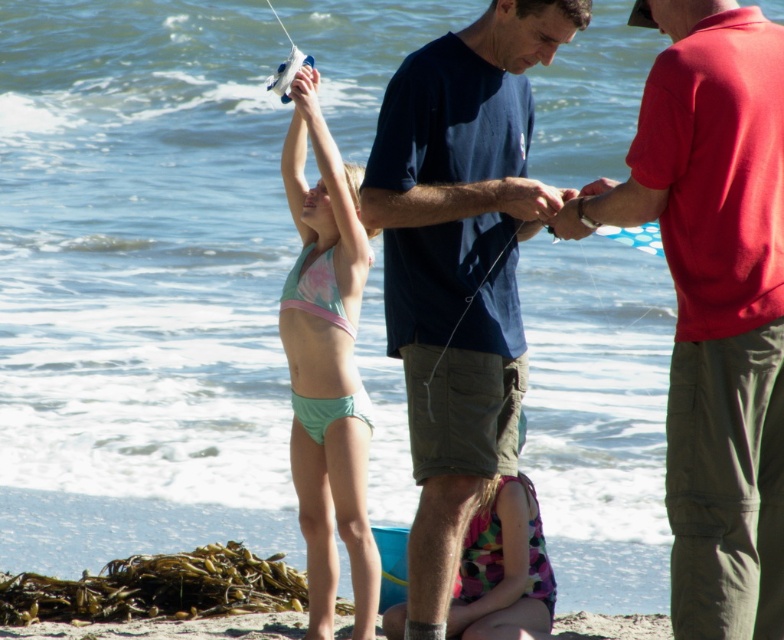
Which is more to the left, red cotton shirt at right or teal fabric bikini at center?

From the viewer's perspective, teal fabric bikini at center appears more on the left side.

Is point (585, 198) in front of point (302, 141)?

That is True.

Who is more forward, [763,461] or [325,582]?

Positioned in front is point [763,461].

Where is `red cotton shirt at right`? red cotton shirt at right is located at coordinates (714, 301).

Who is lower down, teal fabric bikini at center or multicolored polka dot swimsuit at center?

Positioned lower is multicolored polka dot swimsuit at center.

Find the location of a particular element. This screenshot has width=784, height=640. teal fabric bikini at center is located at coordinates (327, 365).

Which is behind, point (322, 595) or point (495, 484)?

Point (322, 595)

Image resolution: width=784 pixels, height=640 pixels. Identify the location of teal fabric bikini at center. (327, 365).

In the scene shown: Does dark blue t-shirt at center appear under multicolored polka dot swimsuit at center?

Actually, dark blue t-shirt at center is above multicolored polka dot swimsuit at center.

Which is above, dark blue t-shirt at center or multicolored polka dot swimsuit at center?

dark blue t-shirt at center is above.

Find the location of a particular element. The height and width of the screenshot is (640, 784). dark blue t-shirt at center is located at coordinates (459, 264).

Identify the location of dark blue t-shirt at center. (459, 264).